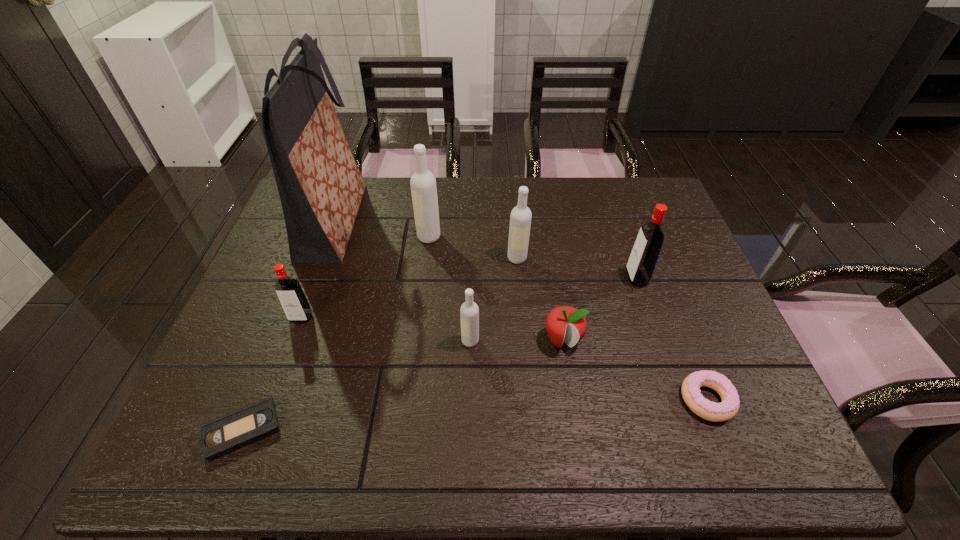
Where is `empty location between the shortest object and the fifth farthest object`? This screenshot has height=540, width=960. empty location between the shortest object and the fifth farthest object is located at coordinates (272, 374).

Identify the location of free space between the red apple and the smaller red vodka. (432, 329).

Select which object is the sixth closest to the second vodka from right to left. Please provide its 2D coordinates. Your answer should be formatted as a tuple, i.e. [(x, y)], where the tuple contains the x and y coordinates of a point satisfying the conditions above.

[(729, 406)]

Where is `object that stands as the fifth closest to the doughnut`? The width and height of the screenshot is (960, 540). object that stands as the fifth closest to the doughnut is located at coordinates (423, 183).

Locate an element on the screen. This screenshot has width=960, height=540. the closest vodka to the videotape is located at coordinates (291, 296).

Locate an element on the screen. Image resolution: width=960 pixels, height=540 pixels. vodka that is the third nearest to the smallest white vodka is located at coordinates (291, 296).

This screenshot has width=960, height=540. What are the coordinates of `white vodka identified as the second closest to the sixth object from right to left` in the screenshot? It's located at (469, 312).

Identify the location of white vodka that is the second nearest to the shopping bag. This screenshot has height=540, width=960. (469, 312).

At what (x,y) coordinates should I click in order to perform the action: click on free location that satisfies the following two spatial constraints: 1. on the front-facing side of the second farthest white vodka; 2. on the right side of the tallest object. Please return your answer as a coordinate pair (x, y). Looking at the image, I should click on (322, 258).

Locate an element on the screen. The width and height of the screenshot is (960, 540). vacant area in the image that satisfies the following two spatial constraints: 1. on the front and back of the nearer red vodka; 2. on the left side of the fifth object from right to left is located at coordinates (293, 341).